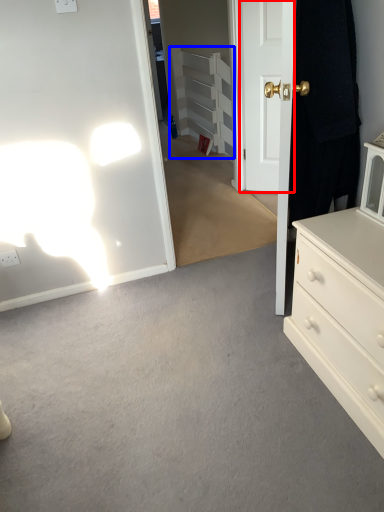
Question: Which of the following is the closest to the observer, door (highlighted by a red box) or armoire (highlighted by a blue box)?

Choices:
 (A) door
 (B) armoire

Answer: (A)